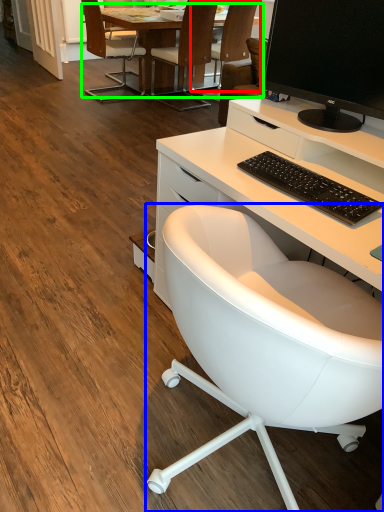
Question: Which object is positioned farthest from chair (highlighted by a red box)? Select from chair (highlighted by a blue box) and table (highlighted by a green box).

Choices:
 (A) chair
 (B) table

Answer: (A)